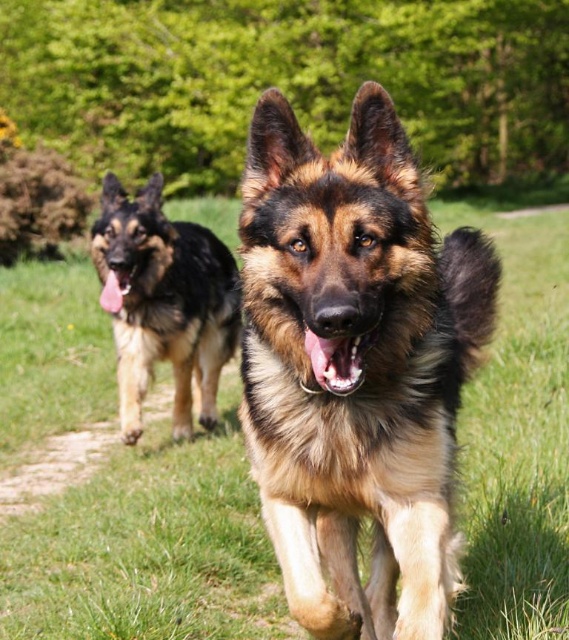
Can you confirm if brown soft grass at center is bigger than smooth brown fur at center?

Indeed, brown soft grass at center has a larger size compared to smooth brown fur at center.

Is brown soft grass at center smaller than smooth brown fur at center?

Incorrect, brown soft grass at center is not smaller in size than smooth brown fur at center.

Locate an element on the screen. Image resolution: width=569 pixels, height=640 pixels. brown soft grass at center is located at coordinates (149, 548).

Where is `brown soft grass at center`? The width and height of the screenshot is (569, 640). brown soft grass at center is located at coordinates (149, 548).

Is brown shaggy dog at center shorter than brown fur dog at left?

Indeed, brown shaggy dog at center has a lesser height compared to brown fur dog at left.

Does brown shaggy dog at center appear on the left side of brown fur dog at left?

Incorrect, brown shaggy dog at center is not on the left side of brown fur dog at left.

Does point (340, 397) come farther from viewer compared to point (191, 340)?

No, it is not.

This screenshot has height=640, width=569. In order to click on brown shaggy dog at center in this screenshot , I will do `click(364, 365)`.

Can you confirm if brown soft grass at center is positioned to the left of brown fur dog at left?

Incorrect, brown soft grass at center is not on the left side of brown fur dog at left.

Does point (18, 326) come farther from viewer compared to point (204, 320)?

Yes, point (18, 326) is farther from viewer.

The height and width of the screenshot is (640, 569). What are the coordinates of `brown soft grass at center` in the screenshot? It's located at (149, 548).